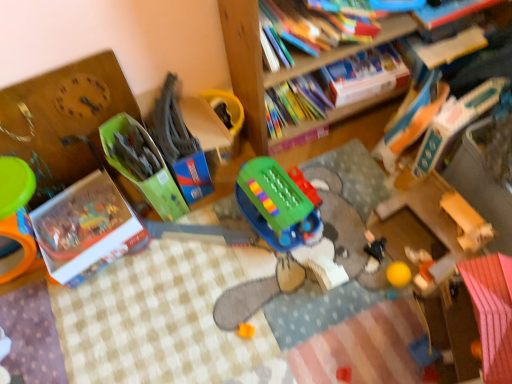
Where is `free space that is in between green plastic toy at center, positioned as the third toy in right-to-left order, and orange matte cube at center, the 4th toy viewed from the right`? The width and height of the screenshot is (512, 384). free space that is in between green plastic toy at center, positioned as the third toy in right-to-left order, and orange matte cube at center, the 4th toy viewed from the right is located at coordinates (252, 274).